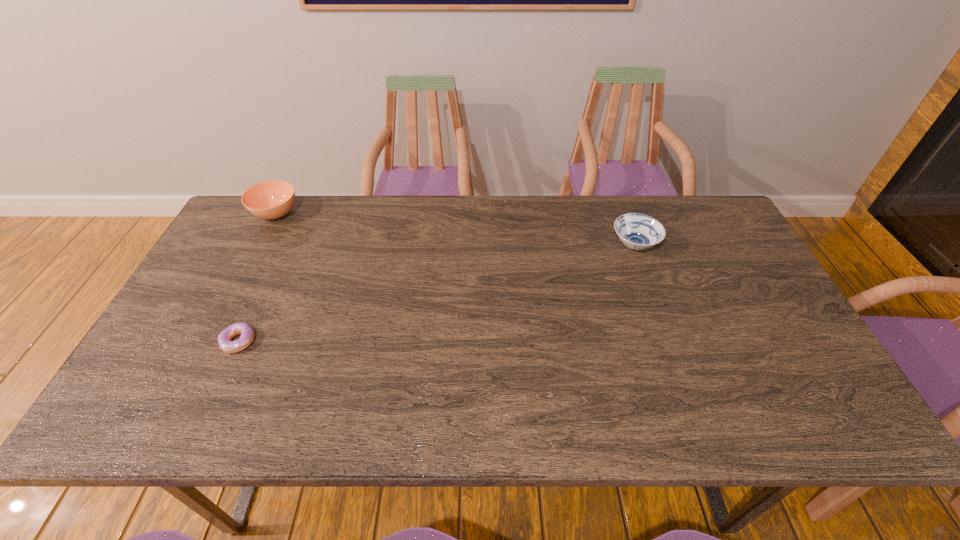
The height and width of the screenshot is (540, 960). I want to click on free space between the nearer soup bowl and the nearest object, so click(x=437, y=293).

Where is `vacant space that's between the shortest object and the left soup bowl`? The height and width of the screenshot is (540, 960). vacant space that's between the shortest object and the left soup bowl is located at coordinates (257, 278).

Find the location of a particular element. vacant point located between the right soup bowl and the nearest object is located at coordinates (x=437, y=293).

Image resolution: width=960 pixels, height=540 pixels. In order to click on free space between the farther soup bowl and the shorter soup bowl in this screenshot , I will do `click(455, 230)`.

Identify the location of vacant area that lies between the right soup bowl and the doughnut. (437, 293).

Locate an element on the screen. This screenshot has width=960, height=540. free space that is in between the shortest object and the farther soup bowl is located at coordinates (257, 278).

Where is `vacant space in between the farther soup bowl and the shortest object`? The image size is (960, 540). vacant space in between the farther soup bowl and the shortest object is located at coordinates (257, 278).

Locate an element on the screen. This screenshot has height=540, width=960. object that is the nearest to the farther soup bowl is located at coordinates (247, 334).

Select which object is the closest to the right soup bowl. Please provide its 2D coordinates. Your answer should be formatted as a tuple, i.e. [(x, y)], where the tuple contains the x and y coordinates of a point satisfying the conditions above.

[(247, 334)]

You are a GUI agent. You are given a task and a screenshot of the screen. Output one action in this format:
    pyautogui.click(x=<x>, y=<y>)
    Task: Click on the vacant space that satisfies the following two spatial constraints: 1. on the front side of the left soup bowl; 2. on the left side of the nearest object
    This screenshot has height=540, width=960.
    Given the screenshot: What is the action you would take?
    pyautogui.click(x=209, y=341)